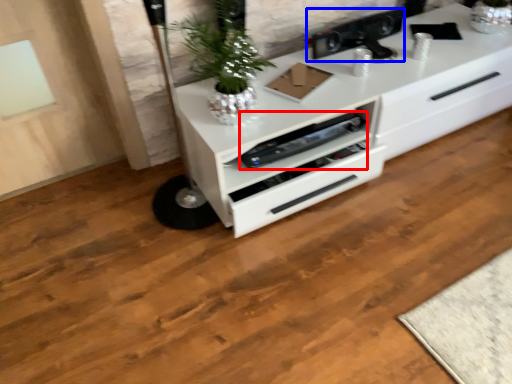
Question: Which object appears farthest to the camera in this image, appliance (highlighted by a red box) or appliance (highlighted by a blue box)?

Choices:
 (A) appliance
 (B) appliance

Answer: (B)